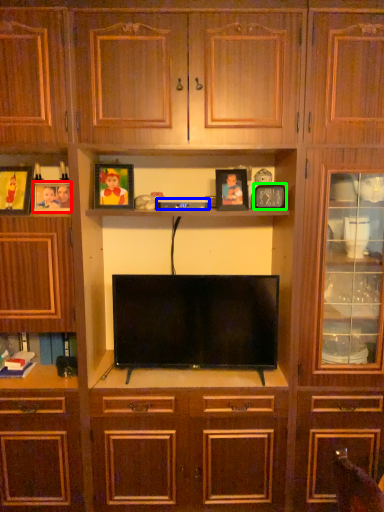
Question: Based on their relative distances, which object is farther from picture frame (highlighted by a red box)? Choose from appliance (highlighted by a blue box) and picture frame (highlighted by a green box).

Choices:
 (A) appliance
 (B) picture frame

Answer: (B)